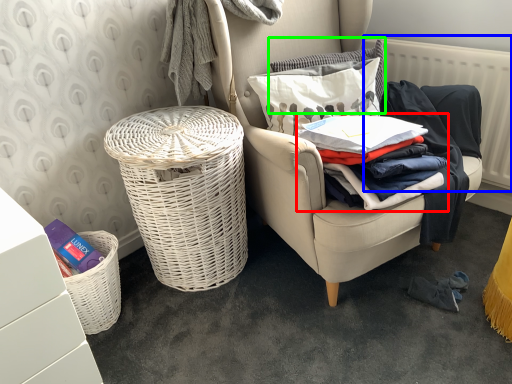
Question: Estimate the real-world distances between objects in this image. Which object is closer to clothing (highlighted by a red box), radiator (highlighted by a blue box) or pillow (highlighted by a green box)?

Choices:
 (A) radiator
 (B) pillow

Answer: (B)